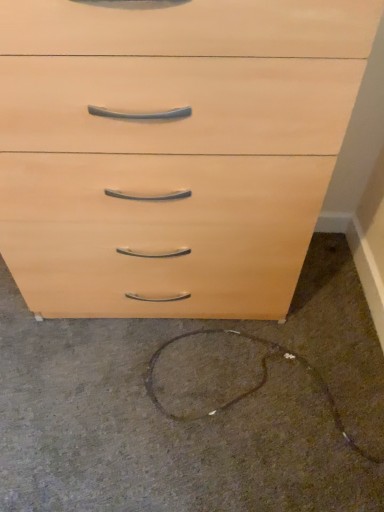
Question: Is point (44, 27) closer or farther from the camera than point (190, 506)?

Choices:
 (A) farther
 (B) closer

Answer: (B)

Question: From a real-world perspective, is matte wood chest of drawers at center physically located above or below brown carpet at lower center?

Choices:
 (A) above
 (B) below

Answer: (A)

Question: Is matte wood chest of drawers at center inside the boundaries of brown carpet at lower center, or outside?

Choices:
 (A) inside
 (B) outside

Answer: (B)

Question: In the image, is brown carpet at lower center on the left side or the right side of matte wood chest of drawers at center?

Choices:
 (A) right
 (B) left

Answer: (A)

Question: Is brown carpet at lower center situated inside matte wood chest of drawers at center or outside?

Choices:
 (A) outside
 (B) inside

Answer: (A)

Question: From the image's perspective, is brown carpet at lower center above or below matte wood chest of drawers at center?

Choices:
 (A) above
 (B) below

Answer: (B)

Question: Is point (238, 414) positioned closer to the camera than point (271, 136)?

Choices:
 (A) closer
 (B) farther

Answer: (B)